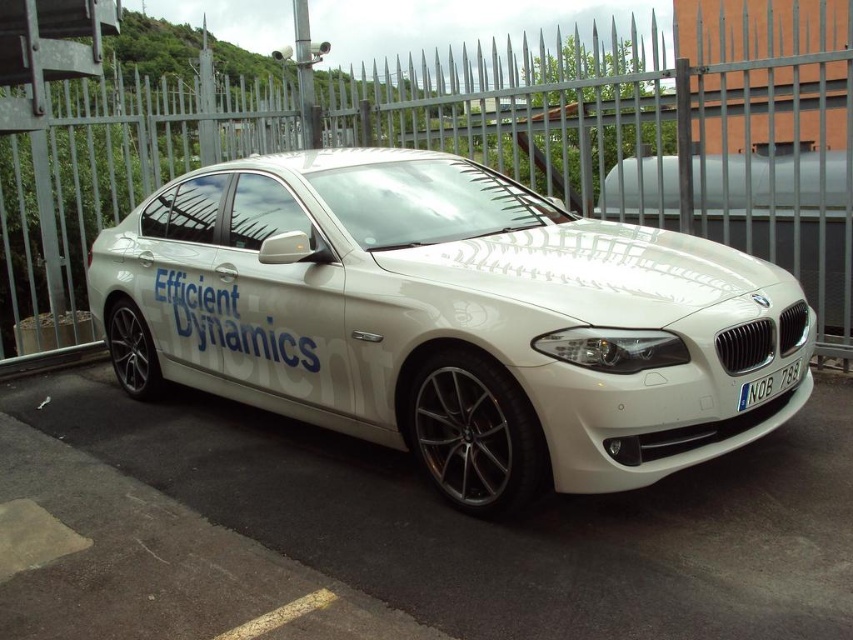
Based on the photo, you are a photographer standing in front of the white glossy car at center and the metallic silver fence at center. You want to take a photo that captures both objects clearly. Since the fence is part of the background, will the car be in focus if you focus on the fence?

The white glossy car at center is closer to the viewer than the metallic silver fence at center. If you focus on the fence, the car will be out of focus because it is at a different distance from the camera.

You are a photographer trying to capture the blue metallic license plate at front clearly while also including the white glossy car at center in the frame. Based on their positions, which object should you focus on first to ensure both are in focus?

You should focus on the white glossy car at center first because it is farther away from the camera than the blue metallic license plate at front. By focusing on the farther object, both will be in focus due to the depth of field.

You are standing at point 0.000, 0.000 in the image coordinate system. Where is the white glossy car at center located relative to your position?

The white glossy car at center is located at point (448, 320) in the image coordinate system.